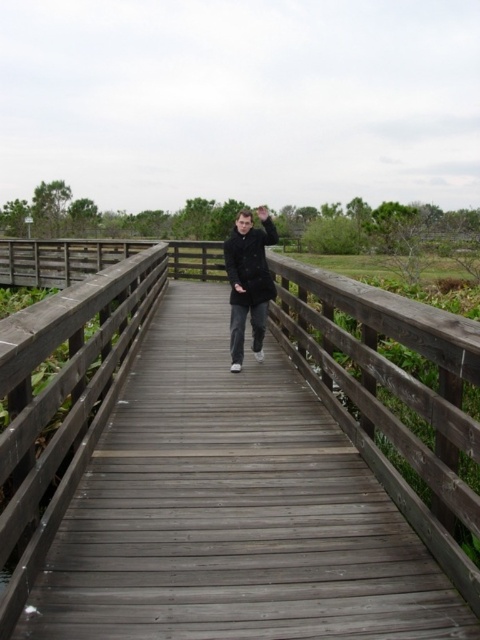
Question: Is wooden bridge at center behind matte black coat at center?

Choices:
 (A) yes
 (B) no

Answer: (B)

Question: Considering the relative positions of wooden bridge at center and matte black coat at center in the image provided, where is wooden bridge at center located with respect to matte black coat at center?

Choices:
 (A) left
 (B) right

Answer: (A)

Question: Considering the relative positions of wooden bridge at center and matte black coat at center in the image provided, where is wooden bridge at center located with respect to matte black coat at center?

Choices:
 (A) below
 (B) above

Answer: (A)

Question: Which point is farther from the camera taking this photo?

Choices:
 (A) (259, 259)
 (B) (453, 442)

Answer: (A)